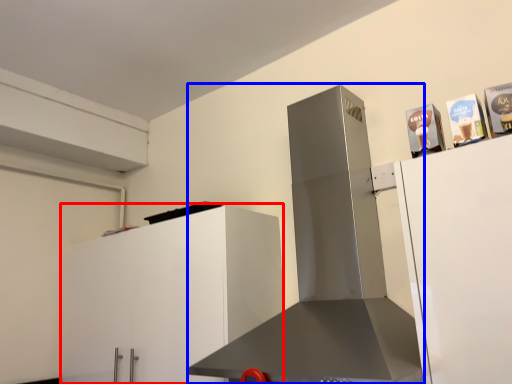
Question: Which of the following is the farthest to the observer, cabinetry (highlighted by a red box) or home appliance (highlighted by a blue box)?

Choices:
 (A) cabinetry
 (B) home appliance

Answer: (A)